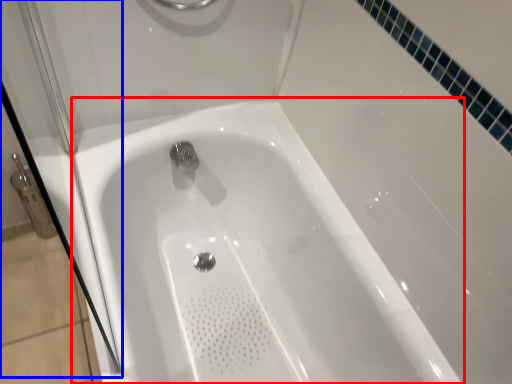
Question: Which of the following is the closest to the observer, bathtub (highlighted by a red box) or shower door (highlighted by a blue box)?

Choices:
 (A) bathtub
 (B) shower door

Answer: (B)